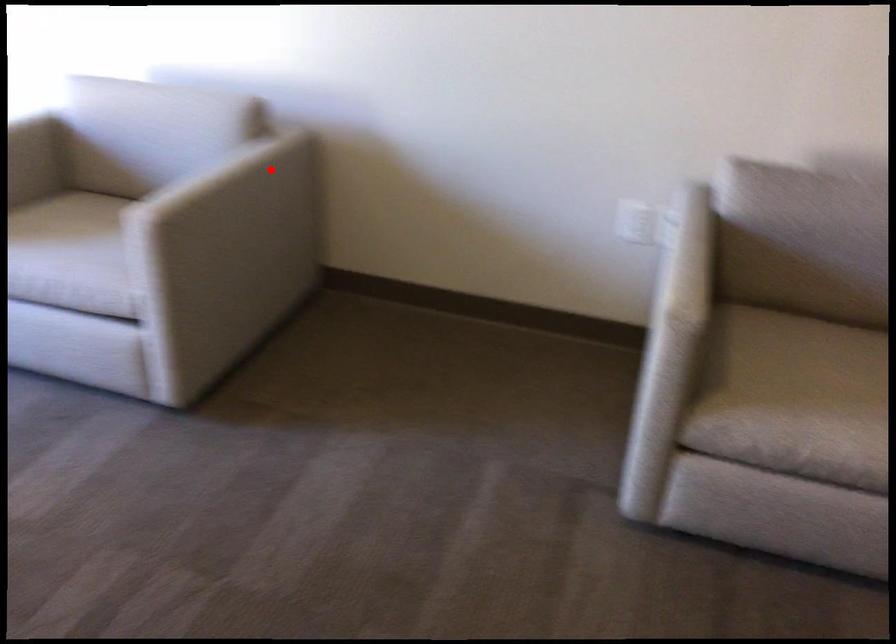
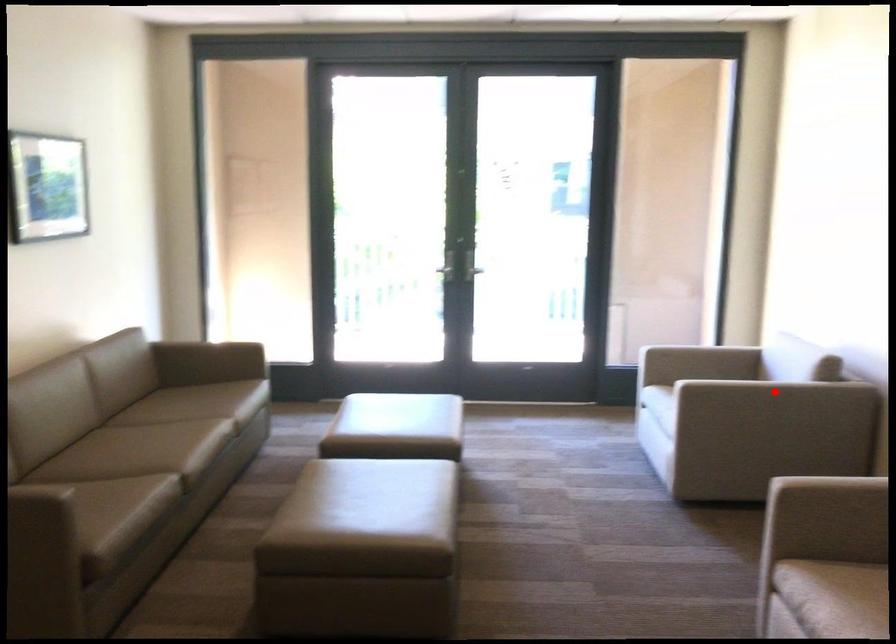
I am providing you with two images of the same scene from different viewpoints. A red point is marked on the first image and another point is marked on the second image. Is the marked point in image1 the same physical position as the marked point in image2?

Yes